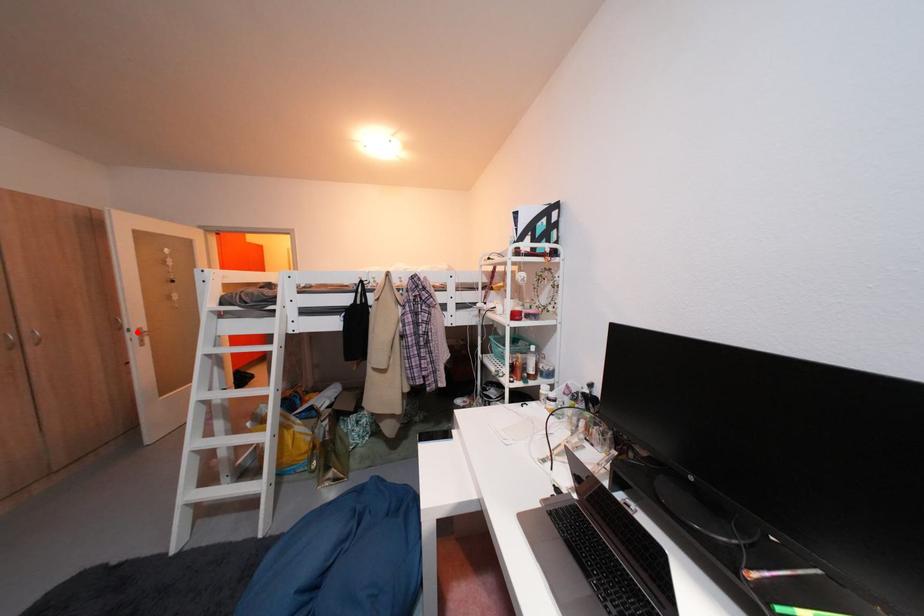
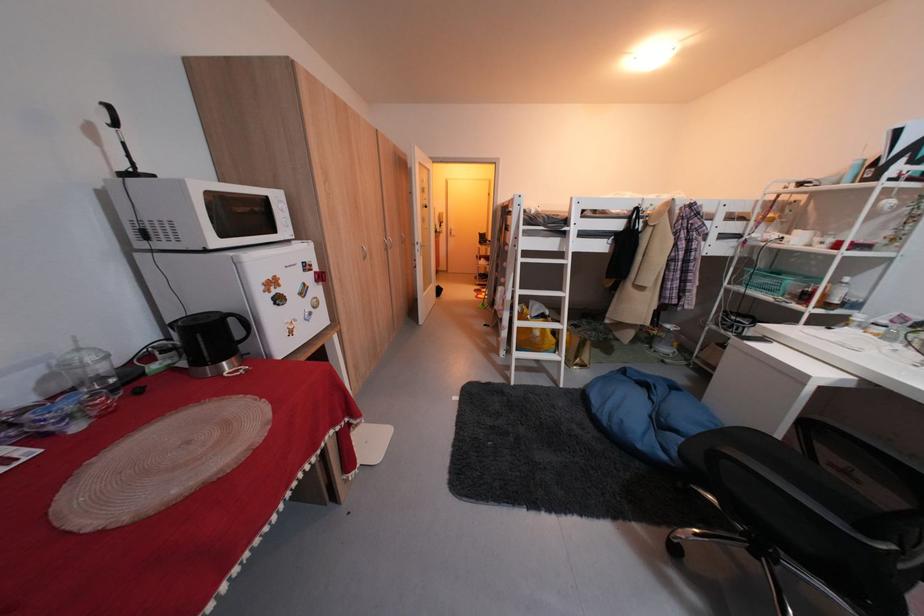
Question: I am providing you with two images of the same scene from different viewpoints. Given a red point in image1, look at the same physical point in image2. Is it:

Choices:
 (A) Closer to the viewpoint
 (B) Farther from the viewpoint

Answer: (A)